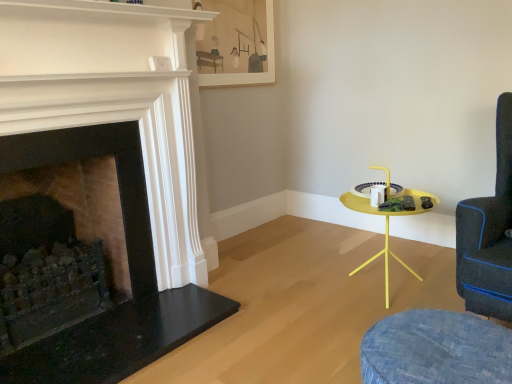
Question: Should I look upward or downward to see matte wooden picture frame at upper center?

Choices:
 (A) down
 (B) up

Answer: (B)

Question: Can you confirm if matte wooden picture frame at upper center is wider than dark stone fireplace at left, marked as the first fireplace in a left-to-right arrangement?

Choices:
 (A) yes
 (B) no

Answer: (B)

Question: From a real-world perspective, is matte wooden picture frame at upper center under dark stone fireplace at left, acting as the second fireplace starting from the right?

Choices:
 (A) no
 (B) yes

Answer: (A)

Question: Is dark stone fireplace at left, acting as the second fireplace starting from the right, inside matte wooden picture frame at upper center?

Choices:
 (A) yes
 (B) no

Answer: (B)

Question: Is matte wooden picture frame at upper center behind dark stone fireplace at left, acting as the second fireplace starting from the right?

Choices:
 (A) no
 (B) yes

Answer: (B)

Question: Is matte wooden picture frame at upper center thinner than dark stone fireplace at left, acting as the second fireplace starting from the right?

Choices:
 (A) no
 (B) yes

Answer: (B)

Question: Is matte wooden picture frame at upper center shorter than dark stone fireplace at left, marked as the first fireplace in a left-to-right arrangement?

Choices:
 (A) no
 (B) yes

Answer: (B)

Question: Is denim swivel chair at lower right, acting as the second swivel chair starting from the right, positioned with its back to matte black fireplace at left, which is the 2th fireplace from left to right?

Choices:
 (A) no
 (B) yes

Answer: (A)

Question: From the image's perspective, is denim swivel chair at lower right, acting as the second swivel chair starting from the right, on matte black fireplace at left, which is the 2th fireplace from left to right?

Choices:
 (A) yes
 (B) no

Answer: (B)

Question: From a real-world perspective, is denim swivel chair at lower right, the 1th swivel chair when ordered from left to right, positioned under matte black fireplace at left, marked as the first fireplace in a right-to-left arrangement, based on gravity?

Choices:
 (A) no
 (B) yes

Answer: (B)

Question: Is denim swivel chair at lower right, acting as the second swivel chair starting from the right, oriented towards matte black fireplace at left, which is the 2th fireplace from left to right?

Choices:
 (A) yes
 (B) no

Answer: (B)

Question: Considering the relative positions of denim swivel chair at lower right, acting as the second swivel chair starting from the right, and matte black fireplace at left, marked as the first fireplace in a right-to-left arrangement, in the image provided, is denim swivel chair at lower right, acting as the second swivel chair starting from the right, in front of matte black fireplace at left, marked as the first fireplace in a right-to-left arrangement,?

Choices:
 (A) no
 (B) yes

Answer: (B)

Question: Does denim swivel chair at lower right, the 1th swivel chair when ordered from left to right, come behind matte black fireplace at left, marked as the first fireplace in a right-to-left arrangement?

Choices:
 (A) no
 (B) yes

Answer: (A)

Question: Considering the relative sizes of matte black fireplace at left, marked as the first fireplace in a right-to-left arrangement, and matte wooden picture frame at upper center in the image provided, is matte black fireplace at left, marked as the first fireplace in a right-to-left arrangement, smaller than matte wooden picture frame at upper center?

Choices:
 (A) no
 (B) yes

Answer: (A)